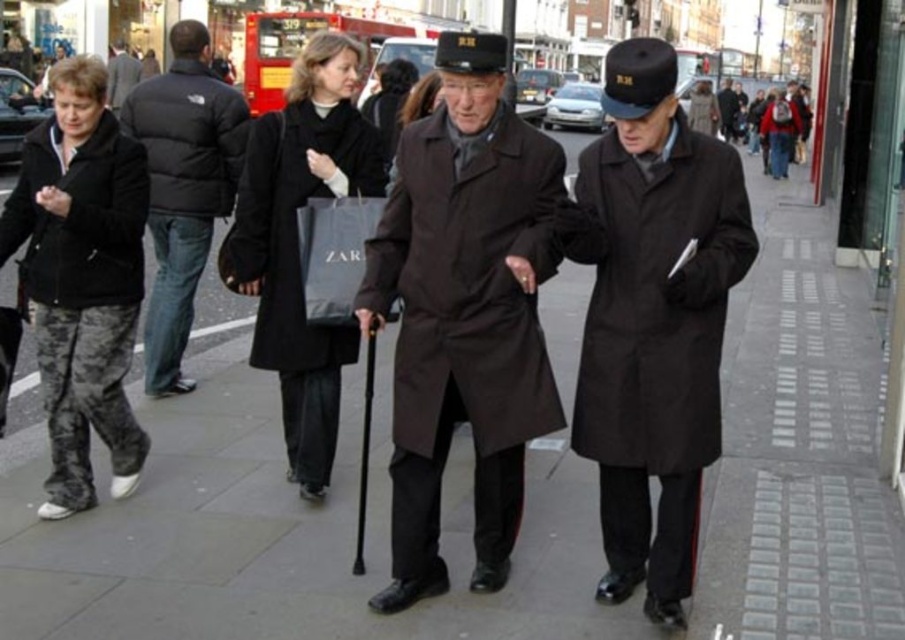
You are a photographer standing at the center of the scene. You want to take a photo of the matte black jacket at left. Which direction should you point your camera to capture it?

The matte black jacket at left is located at point 0.217 on the x axis and 0.209 on the y axis. Since you are at the center, you should point your camera to the left and slightly downward to capture it.

You are standing in the middle of the urban street scene. There are two points marked in the image, one at coordinates point [427,241] and the other at point [326,211]. Which point is closer to you?

Point [427,241] is closer to the viewer than point [326,211].

You are a photographer standing on the sidewalk. You want to take a photo of both the matte black jacket at left and the dark gray wool coat at upper left. Which object should you focus on first to ensure both are in clear focus?

You should focus on the matte black jacket at left first because it is closer to you than the dark gray wool coat at upper left, ensuring both will be in focus when using depth of field properly.